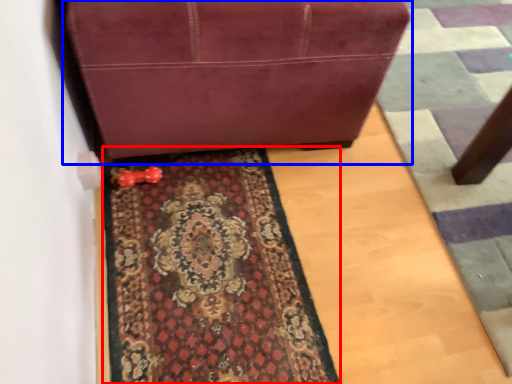
Question: Which object is further to the camera taking this photo, mat (highlighted by a red box) or furniture (highlighted by a blue box)?

Choices:
 (A) mat
 (B) furniture

Answer: (A)